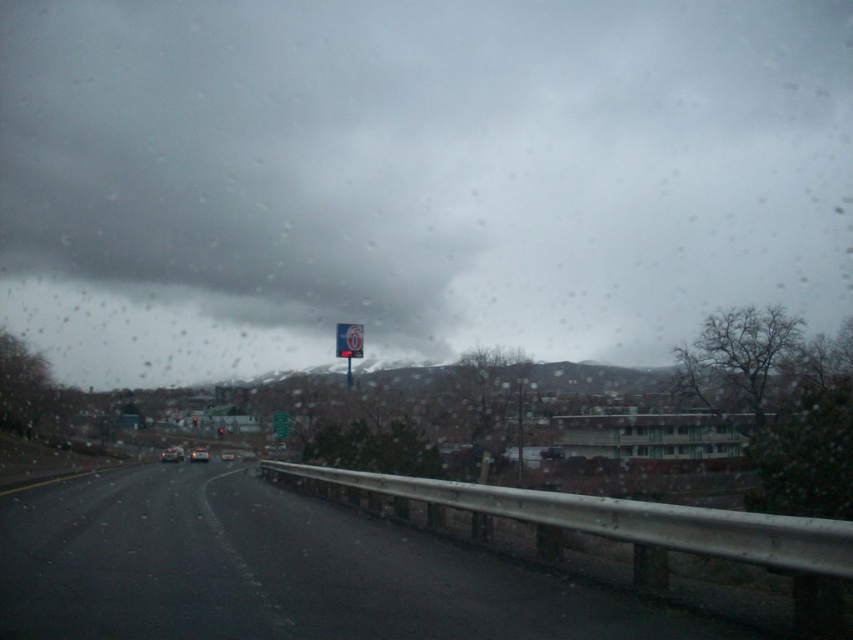
You are driving a car and see the white plastic sign at center and the silver metallic car at center ahead. Which object is wider?

The silver metallic car at center is wider than the white plastic sign at center.